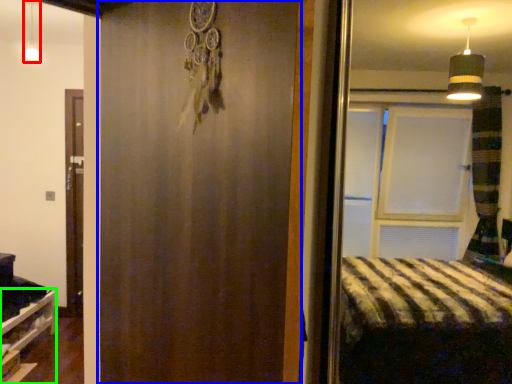
Question: Which is farther away from light fixture (highlighted by a red box)? barn door (highlighted by a blue box) or shelf (highlighted by a green box)?

Choices:
 (A) barn door
 (B) shelf

Answer: (A)